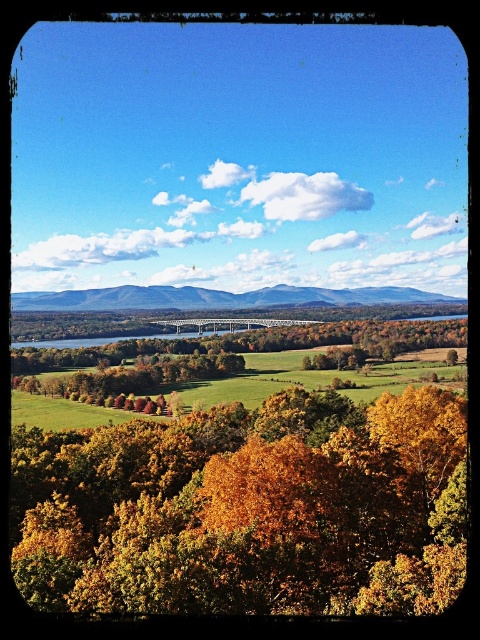
Question: Can you confirm if golden leafy trees at center is thinner than green grassy field at lower center?

Choices:
 (A) no
 (B) yes

Answer: (B)

Question: Can you confirm if golden leafy trees at center is positioned below green grassy field at lower center?

Choices:
 (A) yes
 (B) no

Answer: (A)

Question: Which point is closer to the camera?

Choices:
 (A) green grassy field at lower center
 (B) golden leafy trees at center

Answer: (B)

Question: Does golden leafy trees at center appear on the left side of green grassy field at lower center?

Choices:
 (A) yes
 (B) no

Answer: (B)

Question: Which point appears closest to the camera in this image?

Choices:
 (A) (298, 285)
 (B) (370, 550)

Answer: (B)